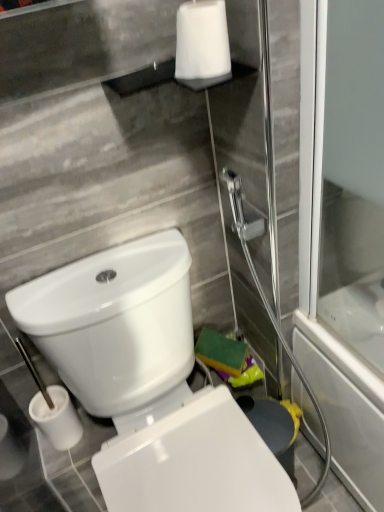
Question: Should I look upward or downward to see white matte toilet paper at upper center?

Choices:
 (A) down
 (B) up

Answer: (B)

Question: From a real-world perspective, is white glossy toilet at lower left positioned over white matte toilet paper at upper center based on gravity?

Choices:
 (A) no
 (B) yes

Answer: (A)

Question: Is white glossy toilet at lower left to the right of white matte toilet paper at upper center from the viewer's perspective?

Choices:
 (A) no
 (B) yes

Answer: (A)

Question: Does white glossy toilet at lower left appear on the left side of white matte toilet paper at upper center?

Choices:
 (A) no
 (B) yes

Answer: (B)

Question: Does white glossy toilet at lower left have a greater height compared to white matte toilet paper at upper center?

Choices:
 (A) no
 (B) yes

Answer: (B)

Question: Can you confirm if white glossy toilet at lower left is smaller than white matte toilet paper at upper center?

Choices:
 (A) no
 (B) yes

Answer: (A)

Question: Can you confirm if white glossy toilet at lower left is thinner than white matte toilet paper at upper center?

Choices:
 (A) no
 (B) yes

Answer: (A)

Question: Is white matte toilet paper at upper center shorter than white glossy toilet at lower left?

Choices:
 (A) yes
 (B) no

Answer: (A)

Question: Is white matte toilet paper at upper center outside of white glossy toilet at lower left?

Choices:
 (A) yes
 (B) no

Answer: (A)

Question: Can you confirm if white matte toilet paper at upper center is positioned to the left of white glossy toilet at lower left?

Choices:
 (A) yes
 (B) no

Answer: (B)

Question: Does white matte toilet paper at upper center have a greater height compared to white glossy toilet at lower left?

Choices:
 (A) no
 (B) yes

Answer: (A)

Question: Would you consider white matte toilet paper at upper center to be distant from white glossy toilet at lower left?

Choices:
 (A) no
 (B) yes

Answer: (A)

Question: From a real-world perspective, is white matte toilet paper at upper center over white glossy toilet at lower left?

Choices:
 (A) no
 (B) yes

Answer: (B)

Question: From a real-world perspective, is white glossy toilet at lower left above or below white matte toilet paper at upper center?

Choices:
 (A) above
 (B) below

Answer: (B)